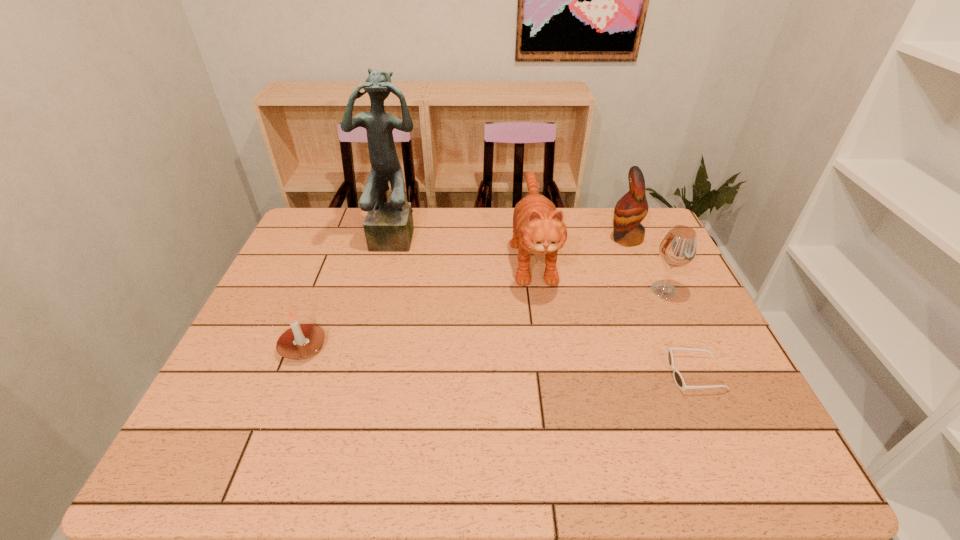
The width and height of the screenshot is (960, 540). In order to click on vacant space located 0.280m on the face of the parrot in this screenshot , I will do `click(521, 238)`.

Image resolution: width=960 pixels, height=540 pixels. In order to click on vacant area located 0.110m on the face of the parrot in this screenshot , I will do `click(574, 238)`.

Find the location of a particular element. This screenshot has height=540, width=960. vacant space positioned on the face of the parrot is located at coordinates (589, 238).

You are a GUI agent. You are given a task and a screenshot of the screen. Output one action in this format:
    pyautogui.click(x=<x>, y=<y>)
    Task: Click on the free space located on the back of the wineglass
    
    Given the screenshot: What is the action you would take?
    pyautogui.click(x=634, y=225)

Locate an element on the screen. vacant space situated on the right of the leftmost object is located at coordinates (x=447, y=347).

Locate an element on the screen. blank space located 0.060m with the lenses of the sunglasses facing outward is located at coordinates (643, 374).

At what (x,y) coordinates should I click in order to perform the action: click on free space located 0.280m with the lenses of the sunglasses facing outward. Please return your answer as a coordinate pair (x, y). Image resolution: width=960 pixels, height=540 pixels. Looking at the image, I should click on (549, 374).

Identify the location of free region located 0.220m with the lenses of the sunglasses facing outward. coord(575,374).

The image size is (960, 540). I want to click on sculpture that is at the far edge, so click(388, 227).

This screenshot has width=960, height=540. What are the coordinates of `cat that is at the far edge` in the screenshot? It's located at (538, 227).